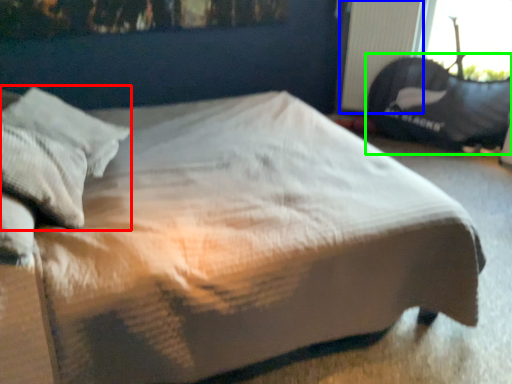
Question: Which object is the closest to the pillow (highlighted by a red box)? Choose among these: radiator (highlighted by a blue box) or bean bag chair (highlighted by a green box).

Choices:
 (A) radiator
 (B) bean bag chair

Answer: (A)